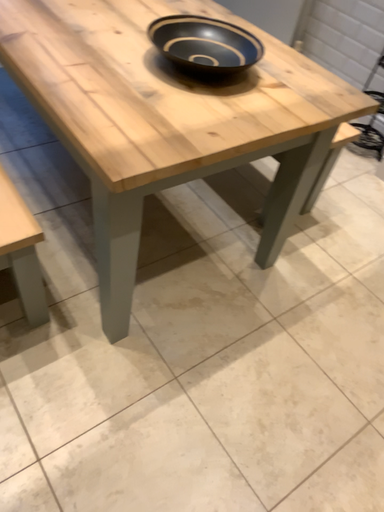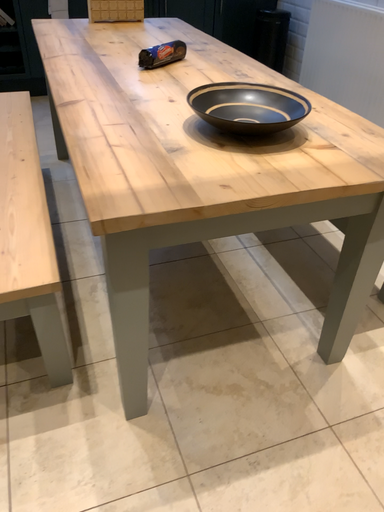
Question: How did the camera likely rotate when shooting the video?

Choices:
 (A) rotated right
 (B) rotated left

Answer: (B)